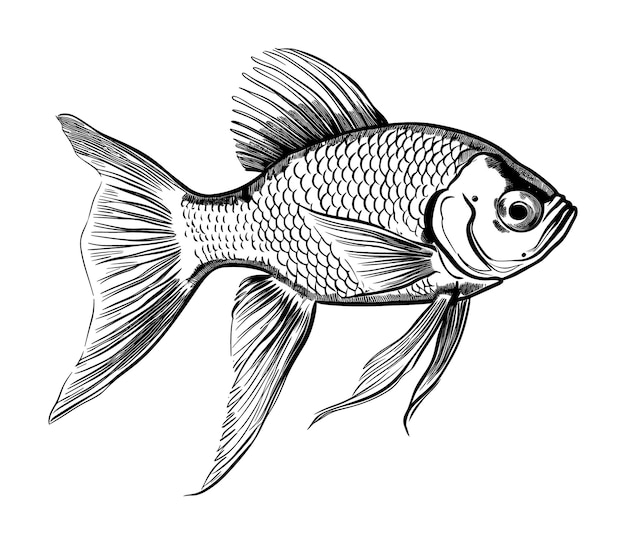
In order to click on scales in this screenshot , I will do `click(305, 257)`.